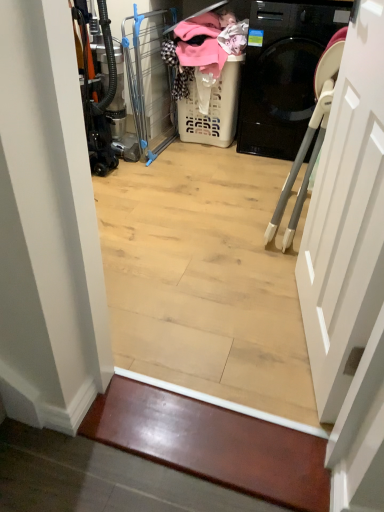
I want to click on white plastic laundry basket at center, so click(x=212, y=109).

Describe the element at coordinates (212, 443) in the screenshot. I see `shiny wood stair at lower center` at that location.

The height and width of the screenshot is (512, 384). In order to click on white plastic laundry basket at center in this screenshot , I will do `click(212, 109)`.

From a real-world perspective, is white plastic laundry basket at center located beneath shiny wood stair at lower center?

Incorrect, from a real-world perspective, white plastic laundry basket at center is higher than shiny wood stair at lower center.

Which of these two, white plastic laundry basket at center or shiny wood stair at lower center, stands shorter?

shiny wood stair at lower center is shorter.

From the image's perspective, between white plastic laundry basket at center and shiny wood stair at lower center, who is located below?

From the image's view, shiny wood stair at lower center is below.

Which object is further away from the camera, white plastic laundry basket at center or shiny wood stair at lower center?

white plastic laundry basket at center is more distant.

How distant is white matte door at right from white plastic laundry basket at center?

They are 5.18 feet apart.

Looking at this image, relative to white plastic laundry basket at center, is white matte door at right in front or behind?

white matte door at right is in front of white plastic laundry basket at center.

Between white matte door at right and white plastic laundry basket at center, which one has larger width?

white plastic laundry basket at center.

Is white matte door at right next to white plastic laundry basket at center?

No.

Measure the distance between shiny wood stair at lower center and clear plastic screen door at center.

They are 1.85 meters apart.

Considering the relative sizes of shiny wood stair at lower center and clear plastic screen door at center in the image provided, is shiny wood stair at lower center thinner than clear plastic screen door at center?

Indeed, shiny wood stair at lower center has a lesser width compared to clear plastic screen door at center.

Identify the location of screen door behind the shiny wood stair at lower center. This screenshot has width=384, height=512. (148, 81).

Where is `screen door that appears above the white plastic laundry basket at center (from a real-world perspective)`? screen door that appears above the white plastic laundry basket at center (from a real-world perspective) is located at coordinates (148, 81).

Based on their sizes in the image, would you say clear plastic screen door at center is bigger or smaller than white plastic laundry basket at center?

clear plastic screen door at center is bigger than white plastic laundry basket at center.

Is clear plastic screen door at center facing away from white plastic laundry basket at center?

clear plastic screen door at center does not have its back to white plastic laundry basket at center.

Does clear plastic screen door at center come behind white plastic laundry basket at center?

That is False.

Which object is thinner, shiny wood stair at lower center or white matte door at right?

With smaller width is white matte door at right.

Can you tell me how much shiny wood stair at lower center and white matte door at right differ in facing direction?

The facing directions of shiny wood stair at lower center and white matte door at right are 73.5 degrees apart.

Can you confirm if shiny wood stair at lower center is bigger than white matte door at right?

No, shiny wood stair at lower center is not bigger than white matte door at right.

Is shiny wood stair at lower center not close to white matte door at right?

No.

Do you think clear plastic screen door at center is within white matte door at right, or outside of it?

clear plastic screen door at center is outside white matte door at right.

The image size is (384, 512). Identify the location of door in front of the clear plastic screen door at center. (346, 218).

From a real-world perspective, does clear plastic screen door at center stand above white matte door at right?

No, from a real-world perspective, clear plastic screen door at center is not on top of white matte door at right.

Looking at this image, how many degrees apart are the facing directions of clear plastic screen door at center and white matte door at right?

They differ by 74.6 degrees in their facing directions.

Is the depth of white matte door at right greater than that of shiny wood stair at lower center?

No, it is not.

Is white matte door at right bigger than shiny wood stair at lower center?

Yes, white matte door at right is bigger than shiny wood stair at lower center.

Is white matte door at right thinner than shiny wood stair at lower center?

Yes.

Consider the image. From a real-world perspective, who is located lower, white matte door at right or shiny wood stair at lower center?

A: In real-world perspective, shiny wood stair at lower center is lower.

Locate an element on the screen. This screenshot has height=512, width=384. stairwell on the left of white plastic laundry basket at center is located at coordinates coord(212,443).

Locate an element on the screen. door in front of the white plastic laundry basket at center is located at coordinates (346, 218).

Looking at the image, which one is located further to white matte door at right, shiny wood stair at lower center or white plastic laundry basket at center?

The object further to white matte door at right is white plastic laundry basket at center.

Consider the image. From the image, which object appears to be nearer to shiny wood stair at lower center, clear plastic screen door at center or white plastic laundry basket at center?

clear plastic screen door at center lies closer to shiny wood stair at lower center than the other object.

When comparing their distances from white matte door at right, does clear plastic screen door at center or shiny wood stair at lower center seem closer?

Based on the image, shiny wood stair at lower center appears to be nearer to white matte door at right.

Estimate the real-world distances between objects in this image. Which object is closer to shiny wood stair at lower center, white plastic laundry basket at center or clear plastic screen door at center?

Among the two, clear plastic screen door at center is located nearer to shiny wood stair at lower center.

Based on their spatial positions, is clear plastic screen door at center or white plastic laundry basket at center further from white matte door at right?

clear plastic screen door at center lies further to white matte door at right than the other object.

Which object lies further to the anchor point shiny wood stair at lower center, white plastic laundry basket at center or white matte door at right?

Based on the image, white plastic laundry basket at center appears to be further to shiny wood stair at lower center.

Based on their spatial positions, is clear plastic screen door at center or shiny wood stair at lower center closer to white plastic laundry basket at center?

clear plastic screen door at center.

Which object lies nearer to the anchor point clear plastic screen door at center, white plastic laundry basket at center or shiny wood stair at lower center?

Based on the image, white plastic laundry basket at center appears to be nearer to clear plastic screen door at center.

Locate an element on the screen. The image size is (384, 512). stairwell between white matte door at right and white plastic laundry basket at center in the front-back direction is located at coordinates (212, 443).

At what (x,y) coordinates should I click in order to perform the action: click on screen door between white matte door at right and white plastic laundry basket at center in the front-back direction. Please return your answer as a coordinate pair (x, y). Looking at the image, I should click on (148, 81).

You are a GUI agent. You are given a task and a screenshot of the screen. Output one action in this format:
    pyautogui.click(x=<x>, y=<y>)
    Task: Click on the door between clear plastic screen door at center and shiny wood stair at lower center vertically
    The width and height of the screenshot is (384, 512).
    Given the screenshot: What is the action you would take?
    pyautogui.click(x=346, y=218)

Where is `basket that lies between clear plastic screen door at center and shiny wood stair at lower center from top to bottom`? The height and width of the screenshot is (512, 384). basket that lies between clear plastic screen door at center and shiny wood stair at lower center from top to bottom is located at coordinates [x=212, y=109].